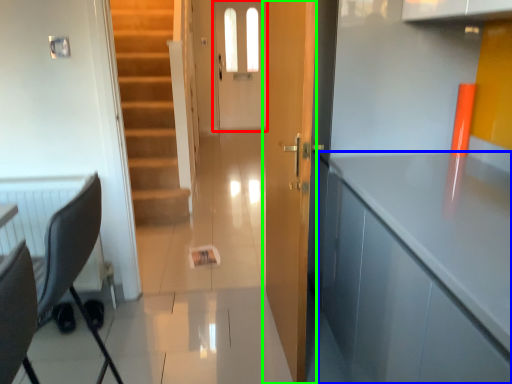
Question: Based on their relative distances, which object is nearer to screen door (highlighted by a red box)? Choose from cabinetry (highlighted by a blue box) and door (highlighted by a green box).

Choices:
 (A) cabinetry
 (B) door

Answer: (B)